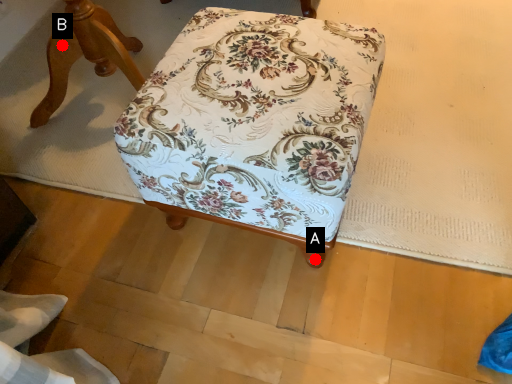
Question: Two points are circled on the image, labeled by A and B beside each circle. Which point is closer to the camera?

Choices:
 (A) A is closer
 (B) B is closer

Answer: (A)